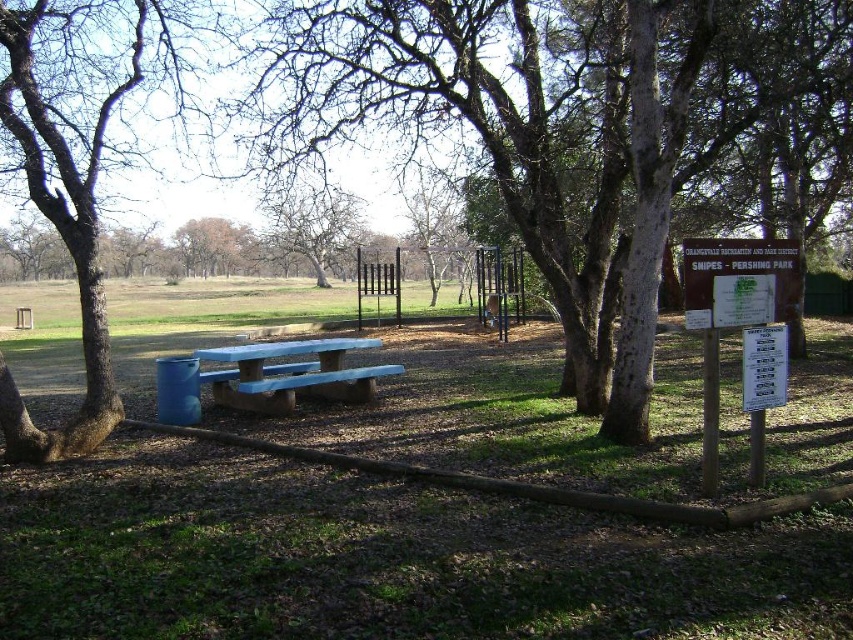
Question: Which point appears closest to the camera in this image?

Choices:
 (A) (454, 188)
 (B) (202, 228)
 (C) (223, 381)
 (D) (364, 51)

Answer: (D)

Question: Estimate the real-world distances between objects in this image. Which object is closer to the green paper sign at right?

Choices:
 (A) bare branches at center
 (B) brown rough tree at center

Answer: (B)

Question: Which point is closer to the camera?

Choices:
 (A) (206, 221)
 (B) (459, 208)

Answer: (B)

Question: Can you confirm if blue concrete picnic table at center is wider than brown rough tree at upper center?

Choices:
 (A) yes
 (B) no

Answer: (B)

Question: Is brown rough tree at center to the left of brown rough tree at upper center from the viewer's perspective?

Choices:
 (A) no
 (B) yes

Answer: (A)

Question: Considering the relative positions of brown rough bark tree at left and green paper sign at right in the image provided, where is brown rough bark tree at left located with respect to green paper sign at right?

Choices:
 (A) left
 (B) right

Answer: (A)